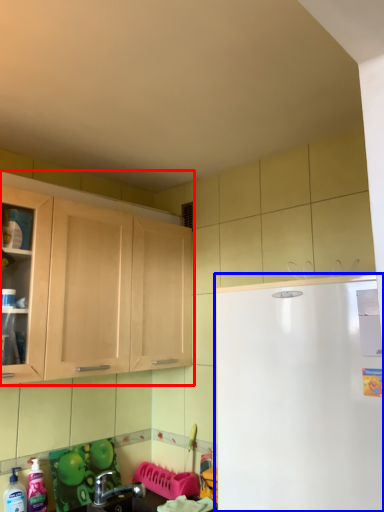
Question: Which of the following is the closest to the observer, cabinetry (highlighted by a red box) or refrigerator (highlighted by a blue box)?

Choices:
 (A) cabinetry
 (B) refrigerator

Answer: (B)